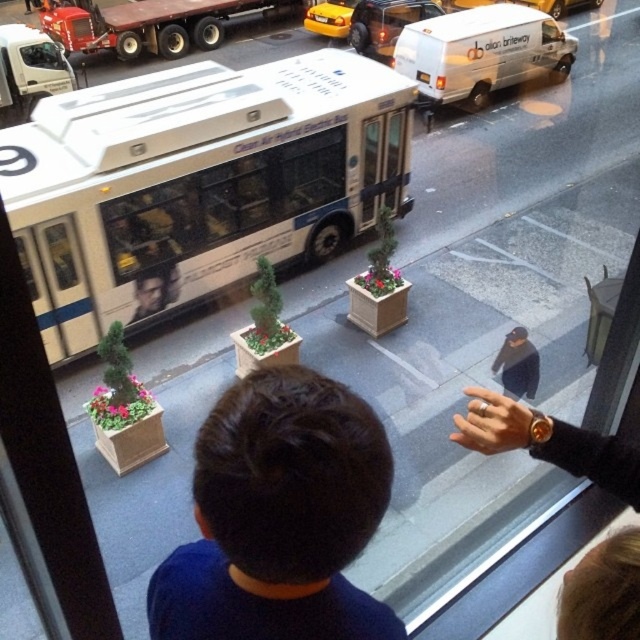
You are standing at point A and want to walk to point B. The path between them is clear except for a small obstacle. If point A is at coordinates point (x=611, y=577) and point B is at coordinates point (x=522, y=337), which direction should you move to reach point B from point A?

To move from point A at coordinates point (x=611, y=577) to point B at coordinates point (x=522, y=337), you should move towards the direction where both the x and y coordinates decrease, as point B is located to the left and slightly above point A.

You are a delivery person trying to locate the dark blue jacket at center. From your current position, which direction should you move to reach it without going through the brown hair at upper right?

Since the brown hair at upper right is in front of the dark blue jacket at center, you should move to the left or behind the brown hair at upper right to reach the dark blue jacket at center without going through it.